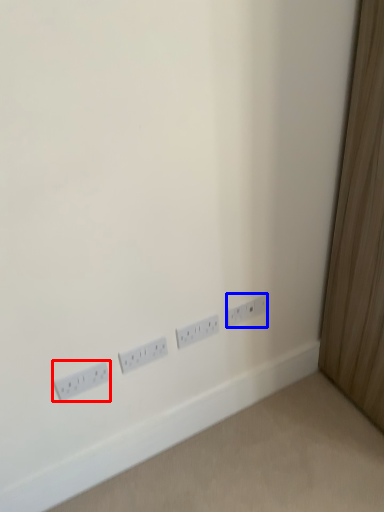
Question: Which point is closer to the camera, power plugs and sockets (highlighted by a red box) or power plugs and sockets (highlighted by a blue box)?

Choices:
 (A) power plugs and sockets
 (B) power plugs and sockets

Answer: (A)